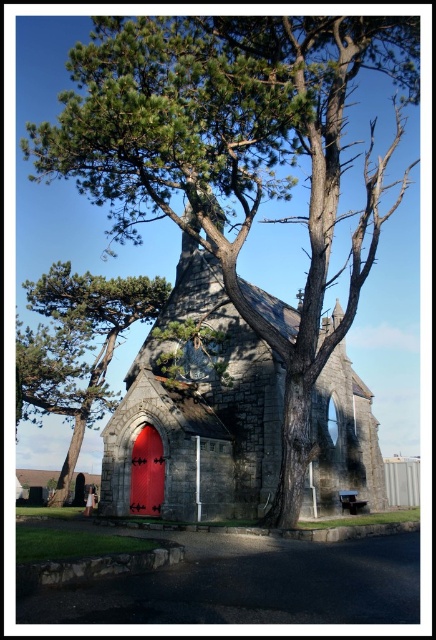
Question: Which is nearer to the shiny red door at center?

Choices:
 (A) green textured pine tree at center
 (B) green textured pine tree at upper left
 (C) stone chapel at center

Answer: (C)

Question: Which point is closer to the camera?

Choices:
 (A) (316, 93)
 (B) (333, 356)
 (C) (155, 465)

Answer: (A)

Question: Does stone chapel at center have a smaller size compared to shiny red door at center?

Choices:
 (A) yes
 (B) no

Answer: (B)

Question: Which point is closer to the camera?

Choices:
 (A) green textured pine tree at upper left
 (B) shiny red door at center
 (C) stone chapel at center

Answer: (A)

Question: Can you confirm if green textured pine tree at upper left is smaller than stone chapel at center?

Choices:
 (A) no
 (B) yes

Answer: (A)

Question: Does stone chapel at center have a greater width compared to green textured pine tree at center?

Choices:
 (A) no
 (B) yes

Answer: (B)